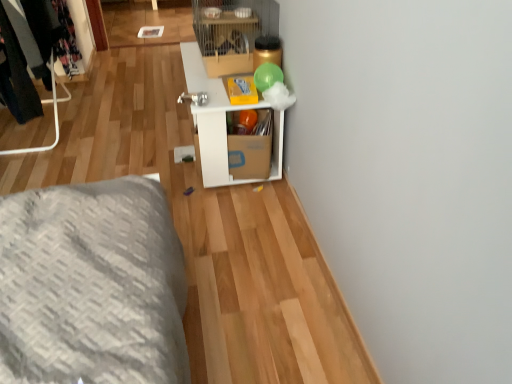
Locate an element on the screen. free space in front of white cardboard shelf at center is located at coordinates (234, 225).